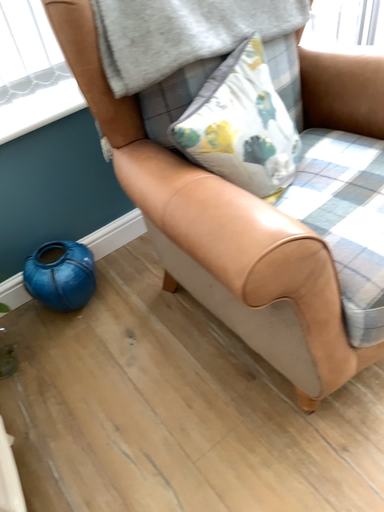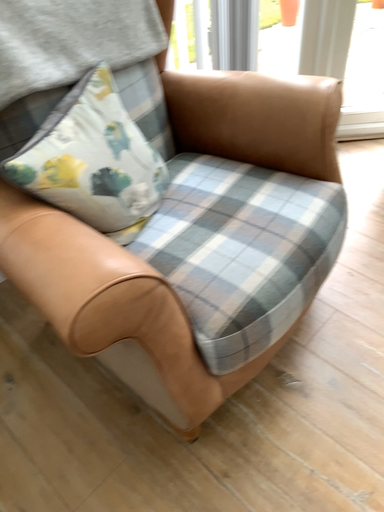
Question: How did the camera likely rotate when shooting the video?

Choices:
 (A) rotated left
 (B) rotated right

Answer: (B)